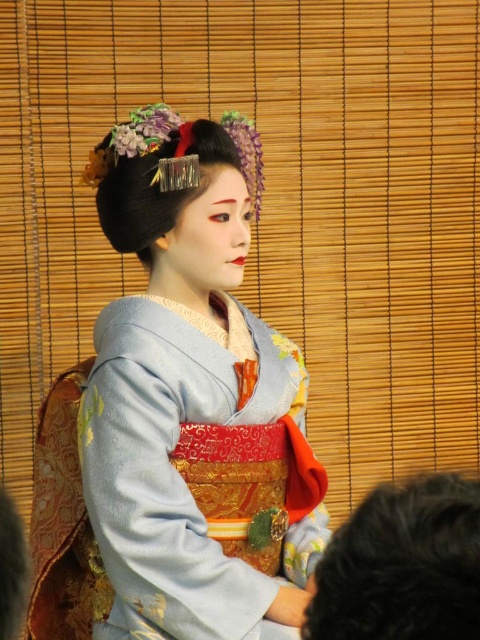
Where is `silky blue kimono at center`? This screenshot has height=640, width=480. silky blue kimono at center is located at coordinates (192, 397).

Based on the photo, does silky blue kimono at center lie behind satin shiny hairpin at upper center?

No, silky blue kimono at center is in front of satin shiny hairpin at upper center.

Measure the distance between silky blue kimono at center and camera.

silky blue kimono at center is 4.57 feet from camera.

Where is `silky blue kimono at center`? Image resolution: width=480 pixels, height=640 pixels. silky blue kimono at center is located at coordinates (192, 397).

Can you confirm if black curly hair at lower right is smaller than satin shiny hairpin at upper center?

Yes.

Is point (301, 632) positioned before point (203, 129)?

Yes, it is in front of point (203, 129).

You are a GUI agent. You are given a task and a screenshot of the screen. Output one action in this format:
    pyautogui.click(x=<x>, y=<y>)
    Task: Click on the black curly hair at lower right
    This screenshot has height=640, width=480.
    Given the screenshot: What is the action you would take?
    pyautogui.click(x=403, y=564)

At what (x,y) coordinates should I click in order to perform the action: click on black curly hair at lower right. Please return your answer as a coordinate pair (x, y). This screenshot has width=480, height=640. Looking at the image, I should click on (403, 564).

Which is above, silky blue kimono at center or black curly hair at lower right?

silky blue kimono at center is above.

Can you confirm if silky blue kimono at center is taller than black curly hair at lower right?

Correct, silky blue kimono at center is much taller as black curly hair at lower right.

Does point (168, 404) come behind point (433, 544)?

Yes, it is.

Identify the location of silky blue kimono at center. (192, 397).